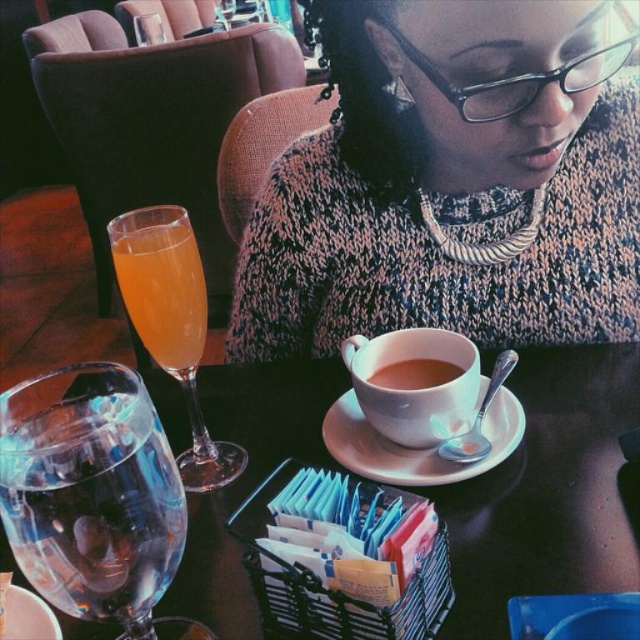
Is point (177, 356) positioned behind point (445, 365)?

No.

Looking at this image, is orange translucent glass at left taller than brown matte cup at center?

Correct, orange translucent glass at left is much taller as brown matte cup at center.

What are the coordinates of `orange translucent glass at left` in the screenshot? It's located at (161, 284).

Who is shorter, transparent glass at lower left or brown matte cup at center?

With less height is brown matte cup at center.

Identify the location of transparent glass at lower left. (92, 496).

Which is above, translucent glass wine glass at left or matte ceramic cup at center?

translucent glass wine glass at left is above.

Is translucent glass wine glass at left above matte ceramic cup at center?

Yes.

Does point (148, 252) come behind point (435, 404)?

Yes, it is.

Identify the location of translucent glass wine glass at left. (172, 323).